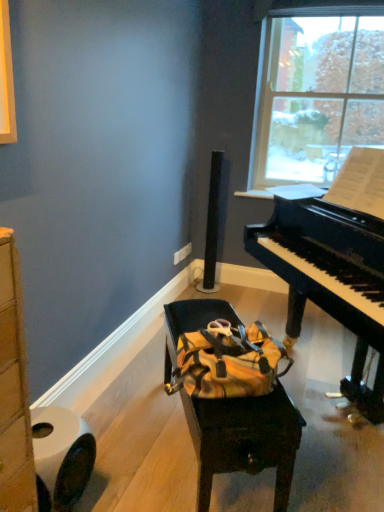
You are a GUI agent. You are given a task and a screenshot of the screen. Output one action in this format:
    pyautogui.click(x=<x>, y=<y>)
    Task: Click on the black polished piano at right
    The height and width of the screenshot is (512, 384).
    Given the screenshot: What is the action you would take?
    pyautogui.click(x=330, y=278)

I want to click on black polished piano at right, so click(x=330, y=278).

Which of these two, white matte toilet paper at lower left or transparent glass window at upper right, stands taller?

With more height is transparent glass window at upper right.

Based on their sizes in the image, would you say white matte toilet paper at lower left is bigger or smaller than transparent glass window at upper right?

In the image, white matte toilet paper at lower left appears to be smaller than transparent glass window at upper right.

Measure the distance from white matte toilet paper at lower left to transparent glass window at upper right.

The distance of white matte toilet paper at lower left from transparent glass window at upper right is 2.70 meters.

Is white matte toilet paper at lower left positioned behind transparent glass window at upper right?

No, it is not.

Is point (372, 405) positioned before point (232, 400)?

No.

Is black polished piano at right facing away from yellow fabric bag at center?

black polished piano at right does not have its back to yellow fabric bag at center.

Who is shorter, black polished piano at right or yellow fabric bag at center?

yellow fabric bag at center is shorter.

How far apart are black polished piano at right and yellow fabric bag at center?

A distance of 71.25 centimeters exists between black polished piano at right and yellow fabric bag at center.

Are white matte toilet paper at lower left and yellow fabric bag at center far apart?

white matte toilet paper at lower left is near yellow fabric bag at center, not far away.

From the image's perspective, is white matte toilet paper at lower left located above or below yellow fabric bag at center?

Based on their image positions, white matte toilet paper at lower left is located beneath yellow fabric bag at center.

Relative to yellow fabric bag at center, is white matte toilet paper at lower left in front or behind?

Visually, white matte toilet paper at lower left is located in front of yellow fabric bag at center.

Does transparent glass window at upper right have a greater width compared to white matte toilet paper at lower left?

Incorrect, the width of transparent glass window at upper right does not surpass that of white matte toilet paper at lower left.

Are transparent glass window at upper right and white matte toilet paper at lower left far apart?

That's right, there is a large distance between transparent glass window at upper right and white matte toilet paper at lower left.

How different are the orientations of transparent glass window at upper right and white matte toilet paper at lower left in degrees?

The angle between the facing direction of transparent glass window at upper right and the facing direction of white matte toilet paper at lower left is 93.1 degrees.

Is transparent glass window at upper right oriented away from white matte toilet paper at lower left?

transparent glass window at upper right does not have its back to white matte toilet paper at lower left.

Considering the points (210, 486) and (346, 22), which point is in front, point (210, 486) or point (346, 22)?

The point (210, 486) is in front.

Which of these two, yellow fabric bag at center or transparent glass window at upper right, is bigger?

Bigger between the two is yellow fabric bag at center.

From a real-world perspective, is yellow fabric bag at center below transparent glass window at upper right?

Yes, from a real-world perspective, yellow fabric bag at center is under transparent glass window at upper right.

Which of these two, yellow fabric bag at center or white matte toilet paper at lower left, stands taller?

Standing taller between the two is yellow fabric bag at center.

In the scene shown: How different are the orientations of yellow fabric bag at center and white matte toilet paper at lower left in degrees?

There is a 27.9-degree angle between the facing directions of yellow fabric bag at center and white matte toilet paper at lower left.

Consider the image. Measure the distance from yellow fabric bag at center to white matte toilet paper at lower left.

A distance of 48.82 centimeters exists between yellow fabric bag at center and white matte toilet paper at lower left.

From a real-world perspective, is yellow fabric bag at center positioned above or below white matte toilet paper at lower left?

In terms of real-world spatial position, yellow fabric bag at center is above white matte toilet paper at lower left.

You are a GUI agent. You are given a task and a screenshot of the screen. Output one action in this format:
    pyautogui.click(x=<x>, y=<y>)
    Task: Click on the piano on the right of transparent glass window at upper right
    The height and width of the screenshot is (512, 384).
    Given the screenshot: What is the action you would take?
    pyautogui.click(x=330, y=278)

Between black polished piano at right and transparent glass window at upper right, which one has smaller size?

With smaller size is transparent glass window at upper right.

Is black polished piano at right oriented towards transparent glass window at upper right?

No.

Which object is further away from the camera, black polished piano at right or transparent glass window at upper right?

transparent glass window at upper right is more distant.

Where is `toilet paper that is under the transparent glass window at upper right (from a real-world perspective)`? The height and width of the screenshot is (512, 384). toilet paper that is under the transparent glass window at upper right (from a real-world perspective) is located at coordinates (61, 457).

I want to click on piano in front of the yellow fabric bag at center, so click(330, 278).

When comparing their distances from yellow fabric bag at center, does black polished piano at right or white matte toilet paper at lower left seem further?

Based on the image, black polished piano at right appears to be further to yellow fabric bag at center.

Considering their positions, is white matte toilet paper at lower left positioned further to black polished piano at right than yellow fabric bag at center?

Based on the image, white matte toilet paper at lower left appears to be further to black polished piano at right.

Considering their positions, is yellow fabric bag at center positioned closer to white matte toilet paper at lower left than transparent glass window at upper right?

yellow fabric bag at center.

Estimate the real-world distances between objects in this image. Which object is closer to white matte toilet paper at lower left, black polished piano at right or yellow fabric bag at center?

Among the two, yellow fabric bag at center is located nearer to white matte toilet paper at lower left.

Estimate the real-world distances between objects in this image. Which object is further from yellow fabric bag at center, black polished piano at right or transparent glass window at upper right?

transparent glass window at upper right is positioned further to the anchor yellow fabric bag at center.

Looking at the image, which one is located closer to transparent glass window at upper right, yellow fabric bag at center or black polished piano at right?

black polished piano at right.

When comparing their distances from black polished piano at right, does transparent glass window at upper right or yellow fabric bag at center seem further?

transparent glass window at upper right.

Considering their positions, is white matte toilet paper at lower left positioned closer to black polished piano at right than transparent glass window at upper right?

white matte toilet paper at lower left.

Locate an element on the screen. This screenshot has height=512, width=384. toilet paper positioned between black polished piano at right and transparent glass window at upper right from near to far is located at coordinates (61, 457).

Where is `furniture positioned between black polished piano at right and transparent glass window at upper right from near to far`? furniture positioned between black polished piano at right and transparent glass window at upper right from near to far is located at coordinates (244, 439).

I want to click on furniture that lies between transparent glass window at upper right and white matte toilet paper at lower left from top to bottom, so click(244, 439).

Locate an element on the screen. The height and width of the screenshot is (512, 384). furniture between white matte toilet paper at lower left and black polished piano at right in the horizontal direction is located at coordinates (244, 439).